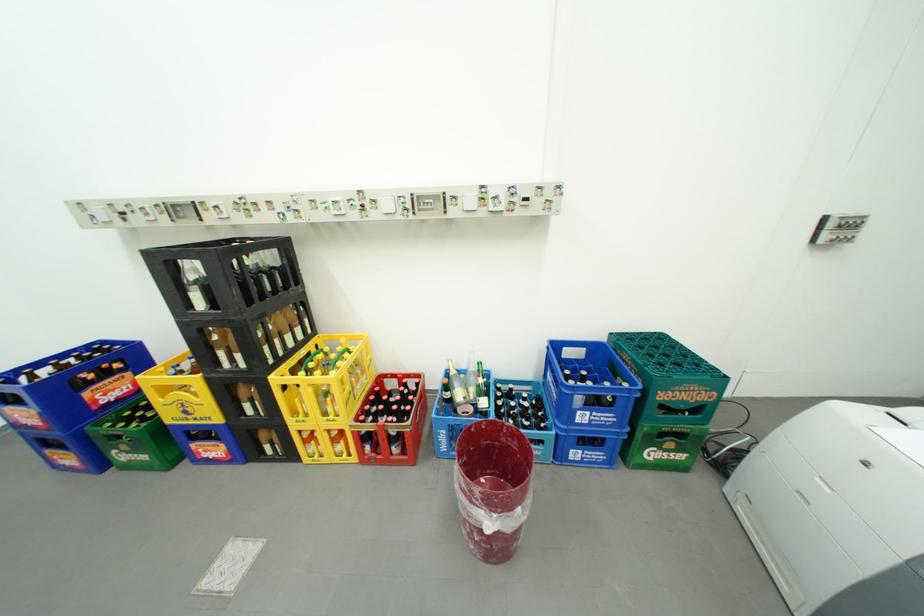
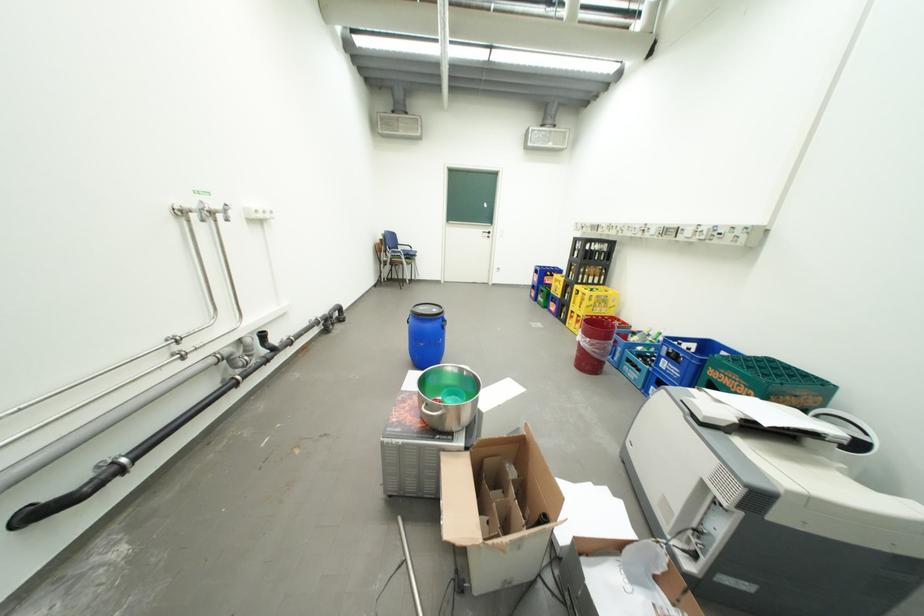
The point at (716, 392) is marked in the first image. Where is the corresponding point in the second image?

(756, 387)